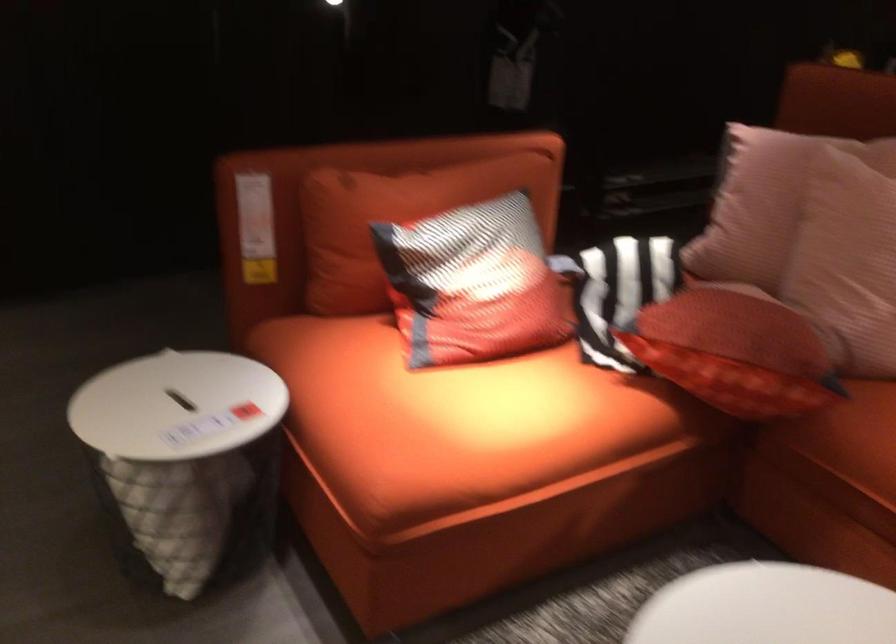
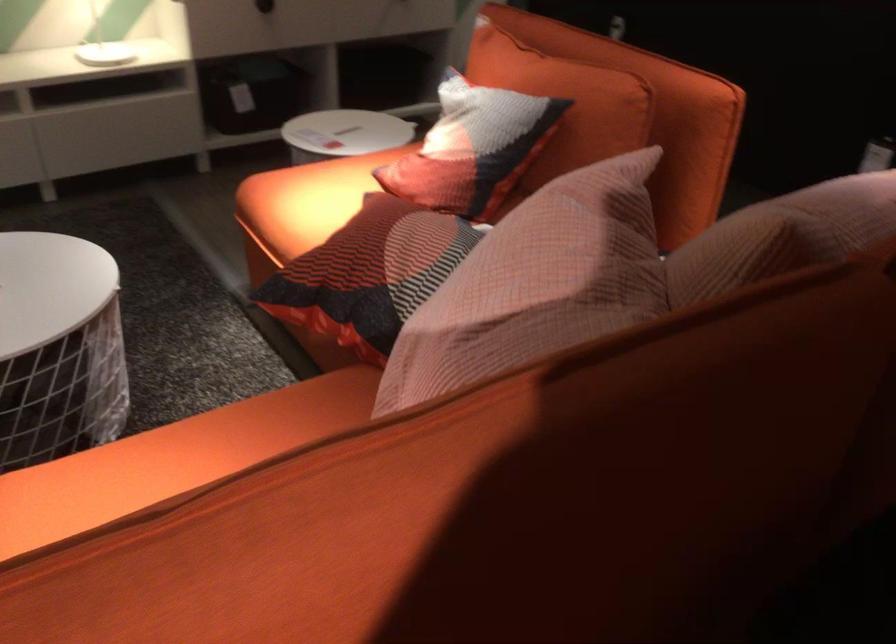
The point at (x=464, y=431) is marked in the first image. Where is the corresponding point in the second image?

(306, 200)